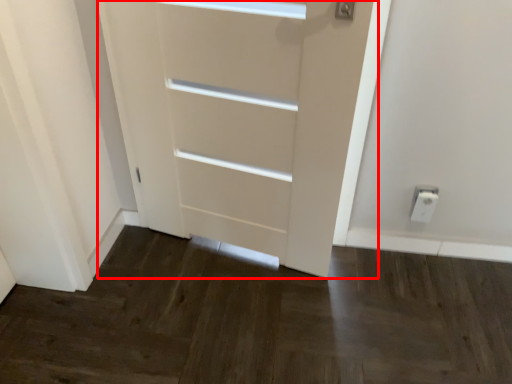
Question: In this image, where is door (annotated by the red box) located relative to electric outlet?

Choices:
 (A) left
 (B) right

Answer: (A)